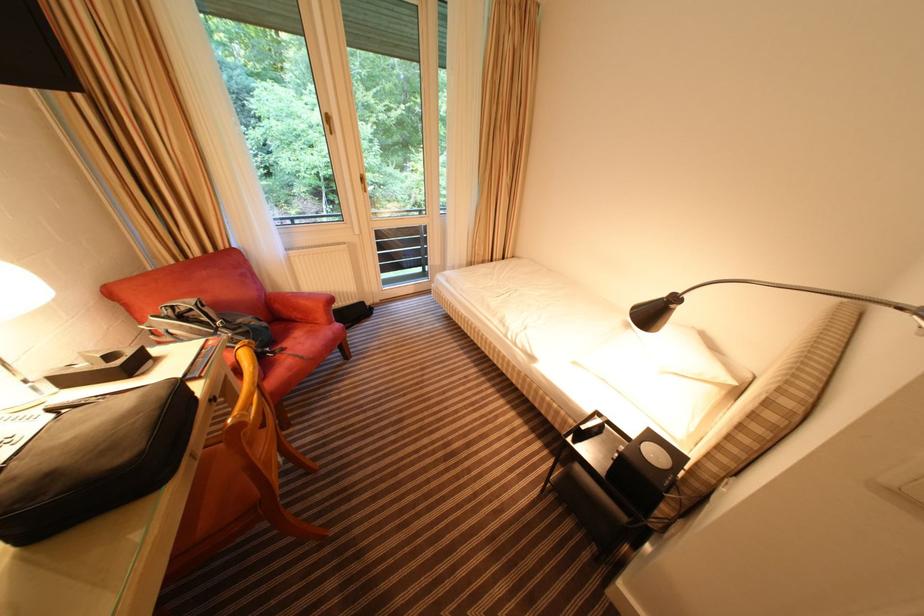
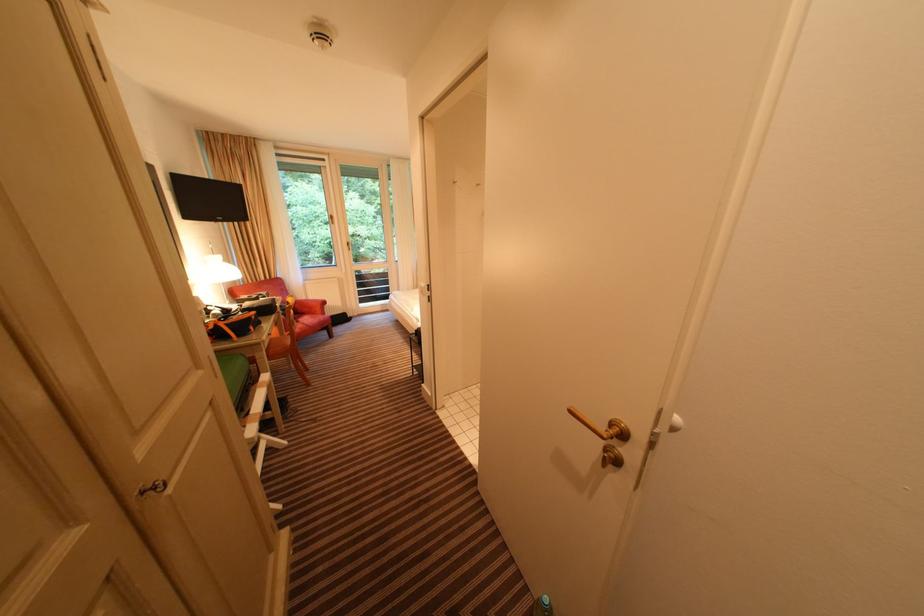
Find the pixel in the second image that matches [289,352] in the first image.

(305, 323)